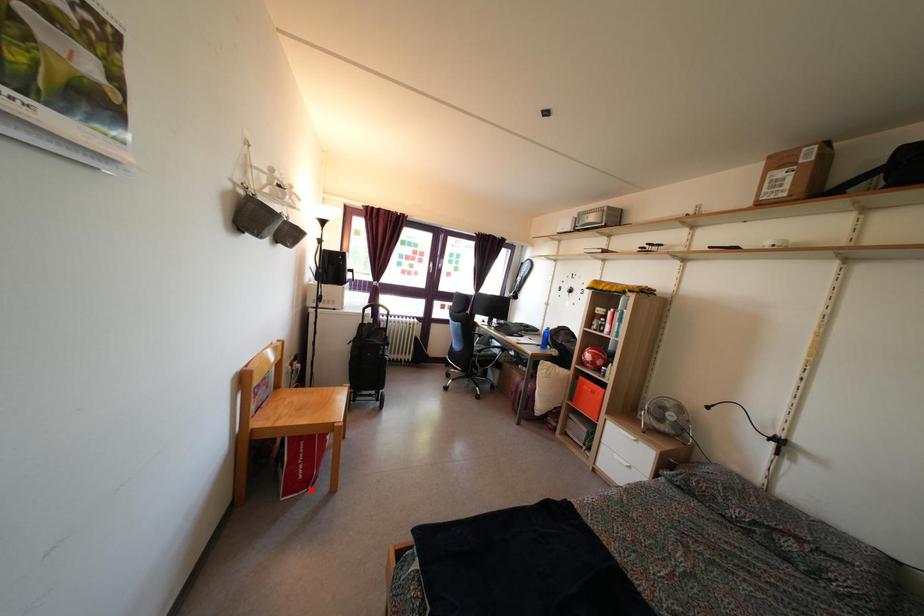
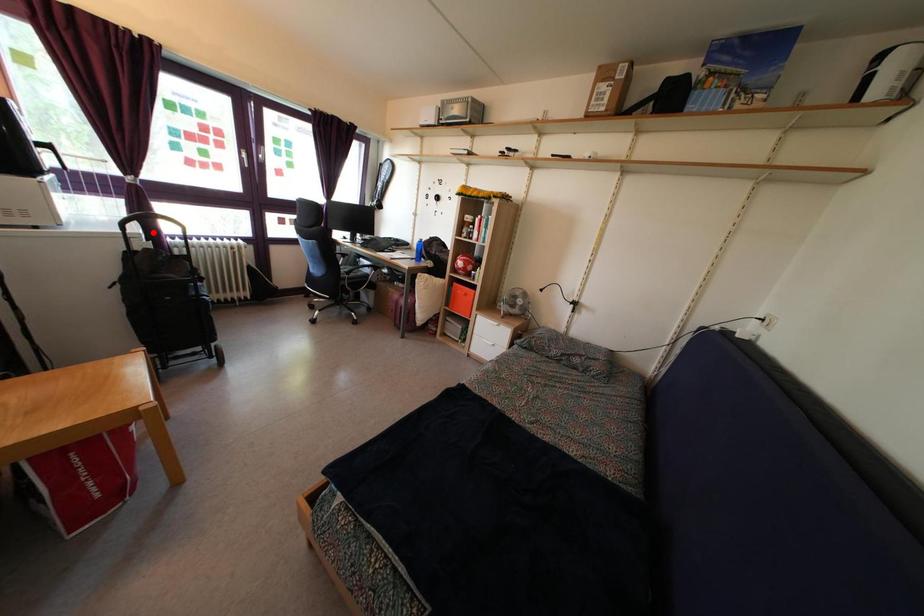
I am providing you with two images of the same scene from different viewpoints. A red point is marked on the first image and another point is marked on the second image. Is the marked point in image1 the same physical position as the marked point in image2?

No